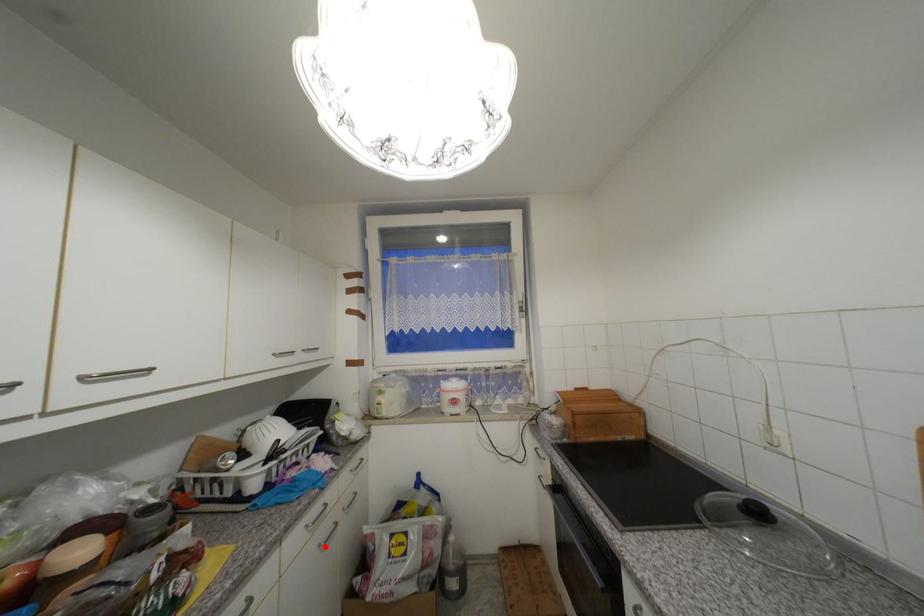
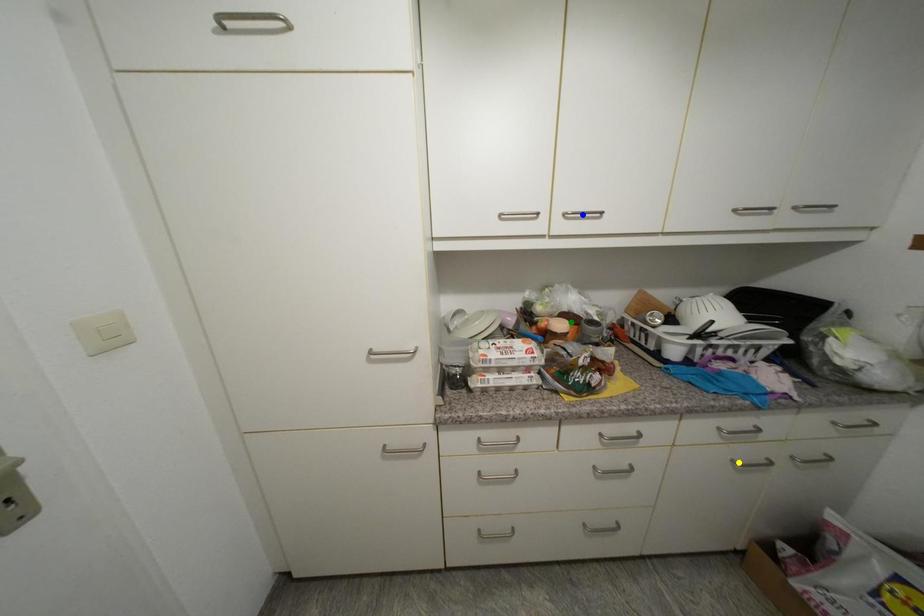
Question: I am providing you with two images of the same scene from different viewpoints. A red point is marked on the first image. You are given multiple points on the second image. Which mark in image 2 goes with the point in image 1?

Choices:
 (A) yellow point
 (B) green point
 (C) blue point

Answer: (A)